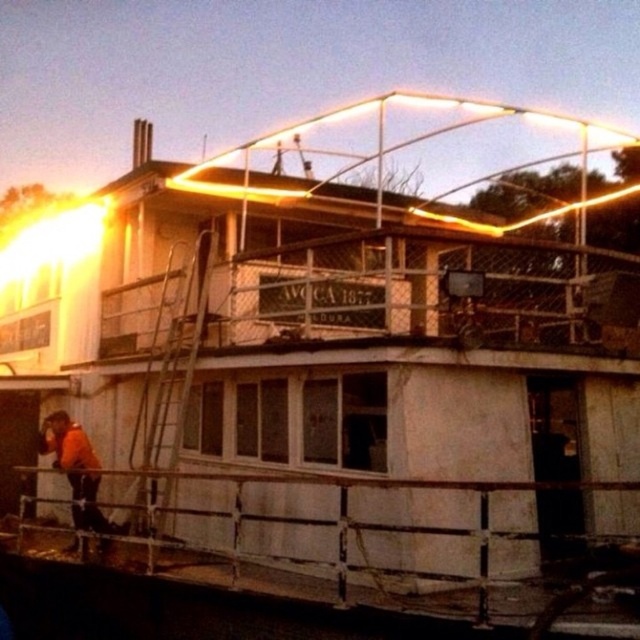
Question: Where is metallic silver ladder at left located in relation to orange fabric construction worker at lower left in the image?

Choices:
 (A) above
 (B) below

Answer: (A)

Question: Which of the following is the farthest from the observer?

Choices:
 (A) (168, 499)
 (B) (83, 490)

Answer: (B)

Question: Which point is closer to the camera?

Choices:
 (A) (70, 422)
 (B) (140, 472)

Answer: (B)

Question: Does metallic silver ladder at left have a lesser width compared to orange fabric construction worker at lower left?

Choices:
 (A) yes
 (B) no

Answer: (A)

Question: Which point is closer to the camera?

Choices:
 (A) orange fabric construction worker at lower left
 (B) metallic silver ladder at left

Answer: (B)

Question: Can you confirm if metallic silver ladder at left is thinner than orange fabric construction worker at lower left?

Choices:
 (A) yes
 (B) no

Answer: (A)